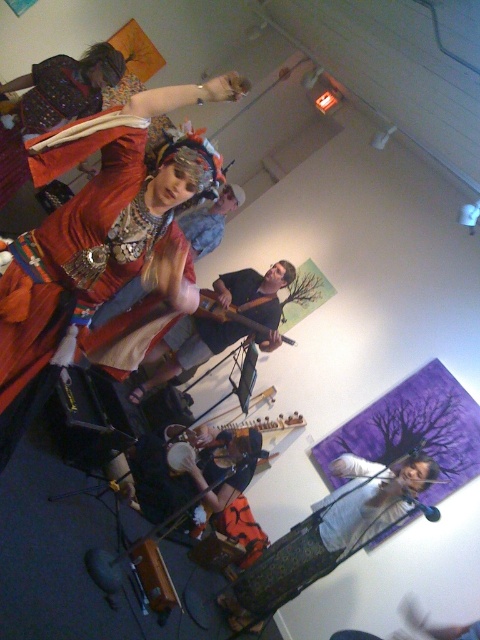
Does matte red dress at center have a greater height compared to wooden stringed instrument at center?

Correct, matte red dress at center is much taller as wooden stringed instrument at center.

Who is lower down, matte red dress at center or wooden stringed instrument at center?

Positioned lower is wooden stringed instrument at center.

Who is more forward, (104, 339) or (295, 426)?

Point (104, 339) is in front.

Identify the location of matte red dress at center. (99, 243).

Does wooden stringed instrument at center have a lesser height compared to wooden acoustic guitar at center?

Incorrect, wooden stringed instrument at center's height does not fall short of wooden acoustic guitar at center's.

Is wooden stringed instrument at center further to camera compared to wooden acoustic guitar at center?

That is False.

You are a GUI agent. You are given a task and a screenshot of the screen. Output one action in this format:
    pyautogui.click(x=<x>, y=<y>)
    Task: Click on the wooden stringed instrument at center
    
    Given the screenshot: What is the action you would take?
    pyautogui.click(x=232, y=429)

Can you confirm if white fabric shirt at center is wider than wooden acoustic guitar at center?

Correct, the width of white fabric shirt at center exceeds that of wooden acoustic guitar at center.

Does white fabric shirt at center have a larger size compared to wooden acoustic guitar at center?

Correct, white fabric shirt at center is larger in size than wooden acoustic guitar at center.

Does point (368, 490) come farther from viewer compared to point (259, 305)?

That is False.

In order to click on white fabric shirt at center in this screenshot , I will do `click(326, 532)`.